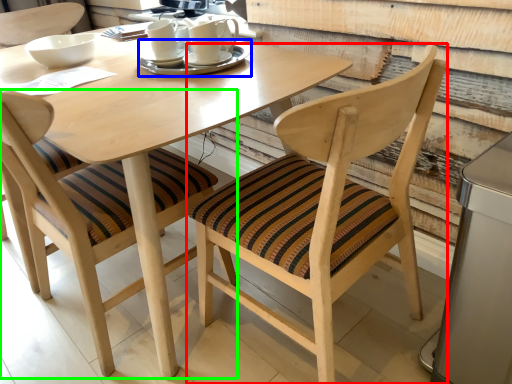
Question: Estimate the real-world distances between objects in this image. Which object is closer to chair (highlighted by a red box), tableware (highlighted by a blue box) or chair (highlighted by a green box)?

Choices:
 (A) tableware
 (B) chair

Answer: (B)